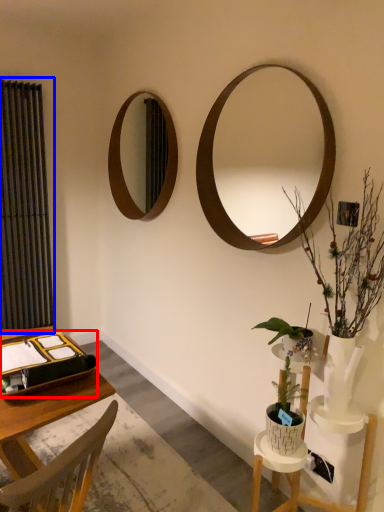
Question: Among these objects, which one is farthest to the camera, binder (highlighted by a red box) or curtain (highlighted by a blue box)?

Choices:
 (A) binder
 (B) curtain

Answer: (B)